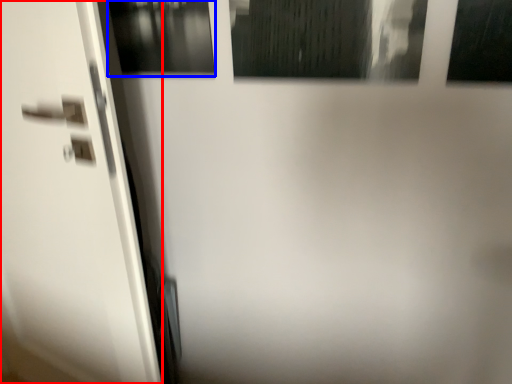
Question: Which object appears farthest to the camera in this image, screen door (highlighted by a red box) or window (highlighted by a blue box)?

Choices:
 (A) screen door
 (B) window

Answer: (B)